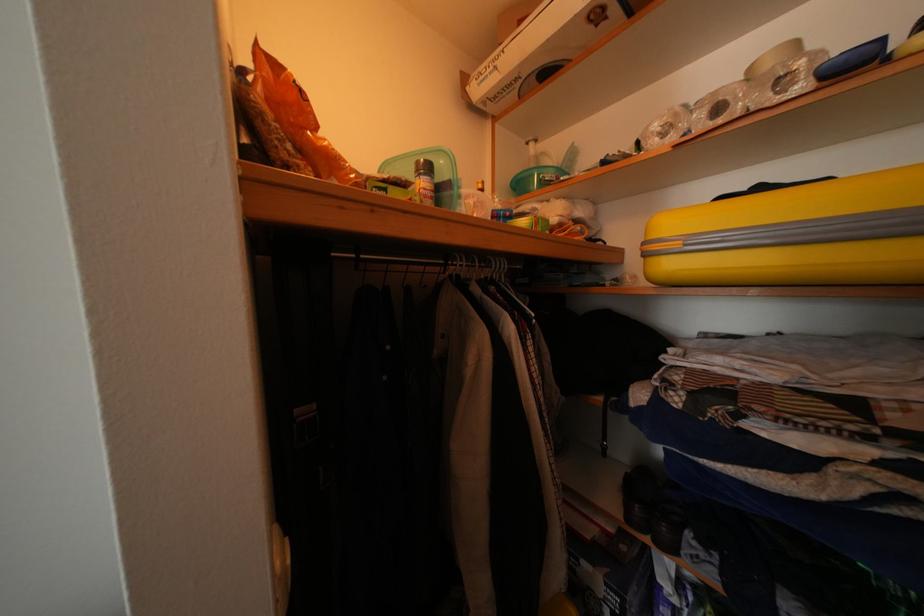
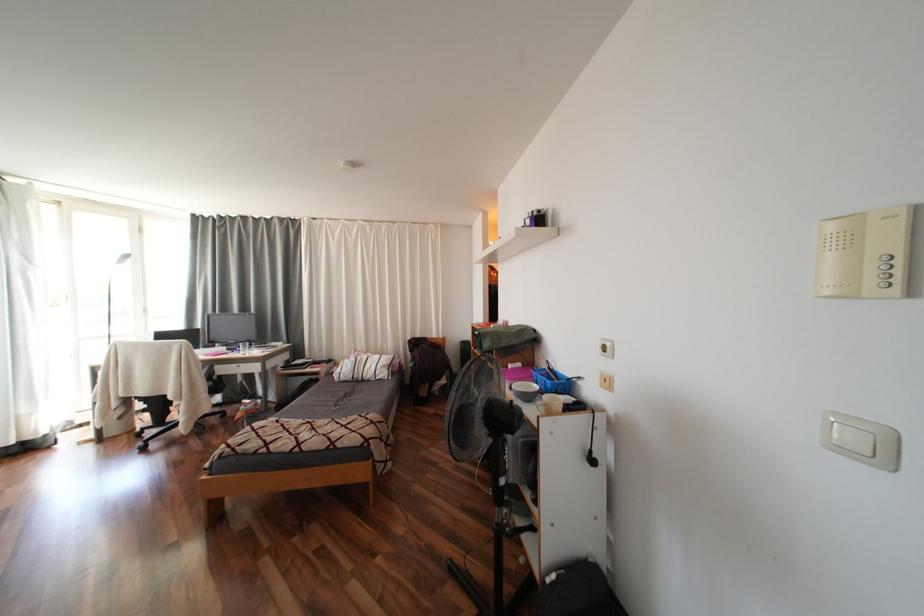
In a continuous first-person perspective shot, in which direction is the camera moving?

The movement direction of the cameraman is right, backward.